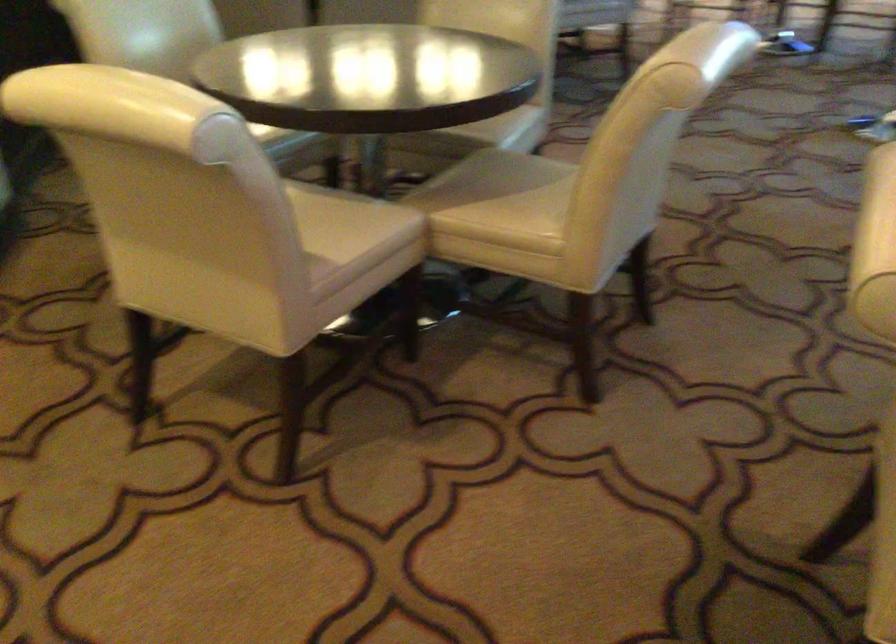
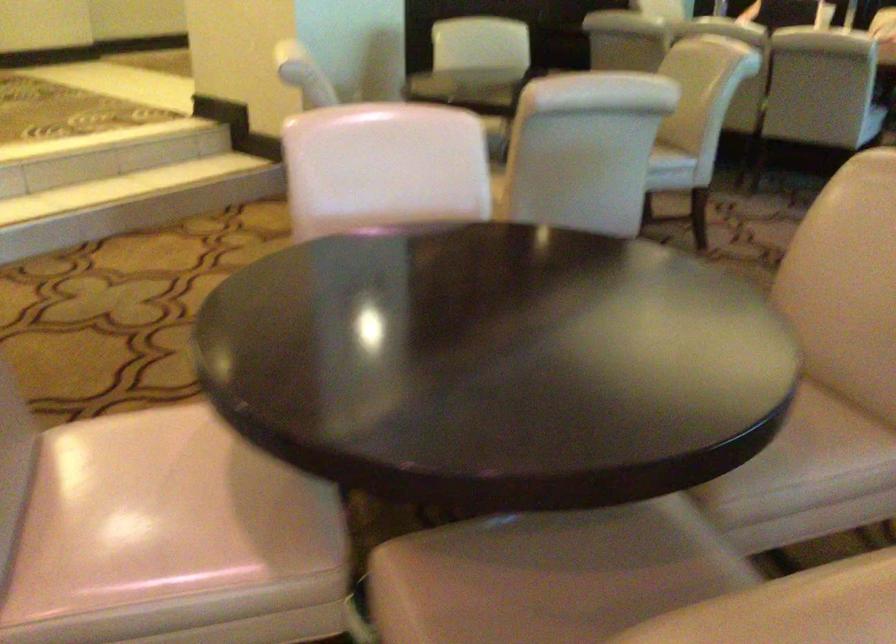
Locate, in the second image, the point that corresponds to (530,116) in the first image.

(670, 163)